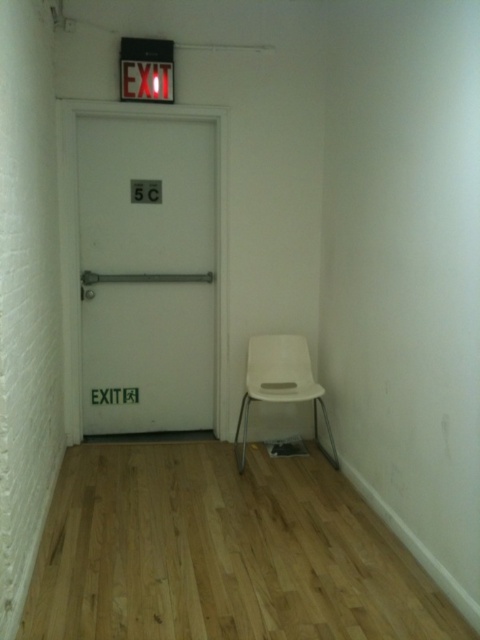
Which is behind, point (264, 385) or point (157, 38)?

The point (264, 385) is more distant.

Which of these two, white plastic chair at lower right or red plastic exit sign at upper center, stands taller?

white plastic chair at lower right

Which is behind, point (307, 376) or point (122, 45)?

The point (307, 376) is more distant.

The image size is (480, 640). I want to click on white plastic chair at lower right, so click(280, 384).

Can you confirm if white matte door at center is taller than red plastic exit sign at upper center?

Yes.

Locate an element on the screen. This screenshot has height=640, width=480. white matte door at center is located at coordinates (146, 273).

Is point (92, 144) behind point (142, 92)?

Yes, it is behind point (142, 92).

The width and height of the screenshot is (480, 640). Identify the location of white matte door at center. (146, 273).

Is point (137, 252) less distant than point (289, 368)?

That is False.

Between point (172, 132) and point (309, 378), which one is positioned in front?

Point (309, 378)

This screenshot has width=480, height=640. In order to click on white matte door at center in this screenshot , I will do `click(146, 273)`.

Where is `white matte door at center`? This screenshot has height=640, width=480. white matte door at center is located at coordinates pos(146,273).